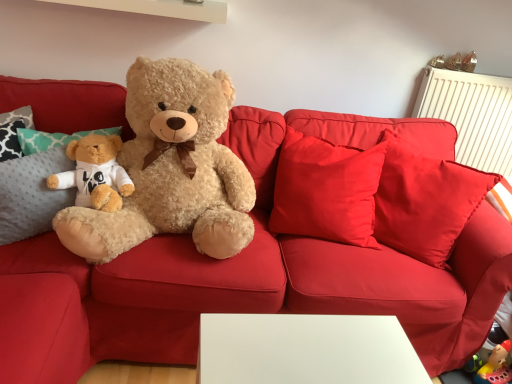
Question: Can metallic gold earrings at upper right, positioned as the second toy in left-to-right order, be found inside fluffy beige teddy bear at left?

Choices:
 (A) yes
 (B) no

Answer: (B)

Question: Is fluffy beige teddy bear at left facing away from metallic gold earrings at upper right, positioned as the second toy in left-to-right order?

Choices:
 (A) no
 (B) yes

Answer: (A)

Question: Is fluffy beige teddy bear at left in contact with metallic gold earrings at upper right, positioned as the second toy in left-to-right order?

Choices:
 (A) yes
 (B) no

Answer: (B)

Question: Can you confirm if fluffy beige teddy bear at left is taller than metallic gold earrings at upper right, which is the 1th toy from right to left?

Choices:
 (A) no
 (B) yes

Answer: (B)

Question: Is fluffy beige teddy bear at left to the left of metallic gold earrings at upper right, positioned as the second toy in left-to-right order, from the viewer's perspective?

Choices:
 (A) no
 (B) yes

Answer: (B)

Question: From the image's perspective, is metallic gold earrings at upper right, positioned as the second toy in left-to-right order, located above or below fluffy beige teddy bear at left?

Choices:
 (A) below
 (B) above

Answer: (B)

Question: Looking at their shapes, would you say metallic gold earrings at upper right, positioned as the second toy in left-to-right order, is wider or thinner than fluffy beige teddy bear at left?

Choices:
 (A) thin
 (B) wide

Answer: (A)

Question: Would you say metallic gold earrings at upper right, which is the 1th toy from right to left, is to the left or to the right of fluffy beige teddy bear at left in the picture?

Choices:
 (A) right
 (B) left

Answer: (A)

Question: Relative to fluffy beige teddy bear at left, is metallic gold earrings at upper right, positioned as the second toy in left-to-right order, in front or behind?

Choices:
 (A) front
 (B) behind

Answer: (B)

Question: Considering the positions of matte brown teddy bear at upper right, which appears as the first toy when viewed from the left, and metallic gold earrings at upper right, which is the 1th toy from right to left, in the image, is matte brown teddy bear at upper right, which appears as the first toy when viewed from the left, taller or shorter than metallic gold earrings at upper right, which is the 1th toy from right to left,?

Choices:
 (A) short
 (B) tall

Answer: (A)

Question: In the image, is matte brown teddy bear at upper right, acting as the second toy starting from the right, positioned in front of or behind metallic gold earrings at upper right, which is the 1th toy from right to left?

Choices:
 (A) front
 (B) behind

Answer: (A)

Question: Considering the positions of point (451, 66) and point (476, 56), is point (451, 66) closer or farther from the camera than point (476, 56)?

Choices:
 (A) closer
 (B) farther

Answer: (A)

Question: Considering the positions of matte brown teddy bear at upper right, acting as the second toy starting from the right, and metallic gold earrings at upper right, positioned as the second toy in left-to-right order, in the image, is matte brown teddy bear at upper right, acting as the second toy starting from the right, bigger or smaller than metallic gold earrings at upper right, positioned as the second toy in left-to-right order,?

Choices:
 (A) small
 (B) big

Answer: (A)

Question: Considering the positions of metallic gold earrings at upper right, positioned as the second toy in left-to-right order, and matte brown teddy bear at upper right, which appears as the first toy when viewed from the left, in the image, is metallic gold earrings at upper right, positioned as the second toy in left-to-right order, wider or thinner than matte brown teddy bear at upper right, which appears as the first toy when viewed from the left,?

Choices:
 (A) thin
 (B) wide

Answer: (B)

Question: Is metallic gold earrings at upper right, positioned as the second toy in left-to-right order, to the left or to the right of matte brown teddy bear at upper right, acting as the second toy starting from the right, in the image?

Choices:
 (A) right
 (B) left

Answer: (A)